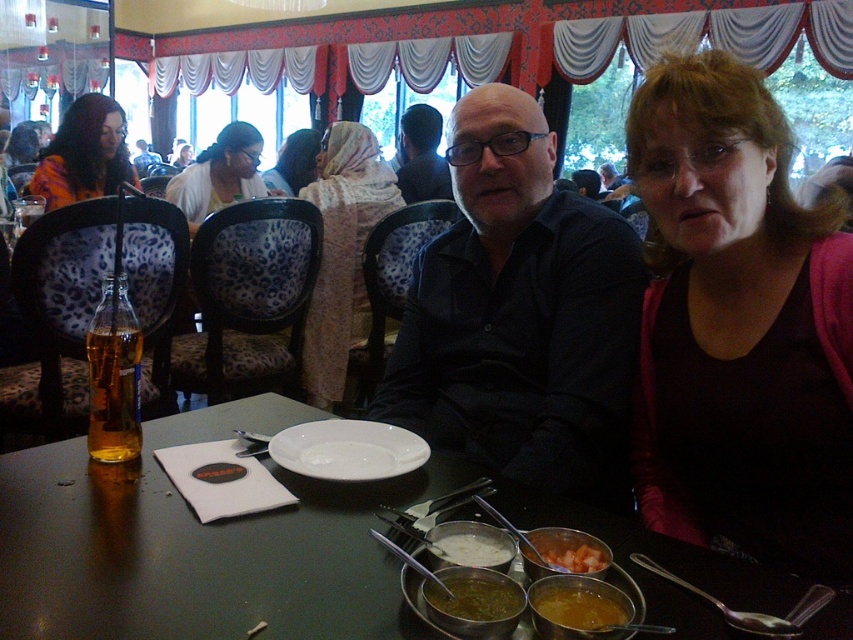
You are a photographer planning to take a group photo of the two people at the table. You need to ensure that both the dark red sweater at right and the orange printed shirt at upper left are clearly visible in the photo. Based on their sizes, which clothing item should you focus on to ensure both are in focus?

The dark red sweater at right is smaller in size compared to the orange printed shirt at upper left. To ensure both are in focus, you should focus on the orange printed shirt at upper left since it is larger and will be easier to capture clearly, allowing the smaller dark red sweater at right to also be in focus.

From the picture: You are a waiter in a restaurant and you need to place a new plate on the table. The table has the tomato sauce at table center and the matte black shirt at center. Where should you place the plate so it doesn not interfere with the existing items?

The tomato sauce at table center is positioned under the matte black shirt at center, so placing the plate on the table away from the area under the matte black shirt at center would avoid interference with the tomato sauce at table center.